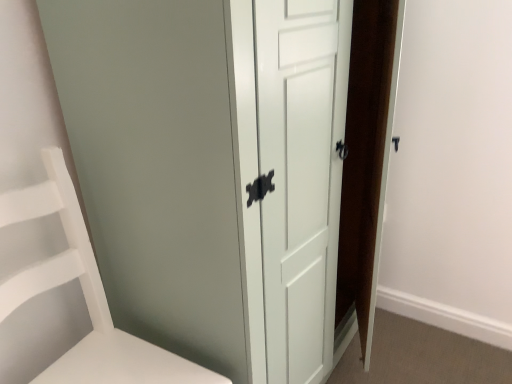
Question: Based on their positions, is white matte shelf at left located to the left or right of white glossy door at center?

Choices:
 (A) left
 (B) right

Answer: (A)

Question: In the image, is white matte shelf at left positioned in front of or behind white glossy door at center?

Choices:
 (A) front
 (B) behind

Answer: (A)

Question: Is white matte shelf at left wider or thinner than white glossy door at center?

Choices:
 (A) wide
 (B) thin

Answer: (B)

Question: Is white glossy door at center wider or thinner than white matte shelf at left?

Choices:
 (A) wide
 (B) thin

Answer: (A)

Question: Is white glossy door at center bigger or smaller than white matte shelf at left?

Choices:
 (A) small
 (B) big

Answer: (B)

Question: Is point (212, 34) closer or farther from the camera than point (88, 279)?

Choices:
 (A) closer
 (B) farther

Answer: (A)

Question: From a real-world perspective, is white glossy door at center positioned above or below white matte shelf at left?

Choices:
 (A) below
 (B) above

Answer: (B)